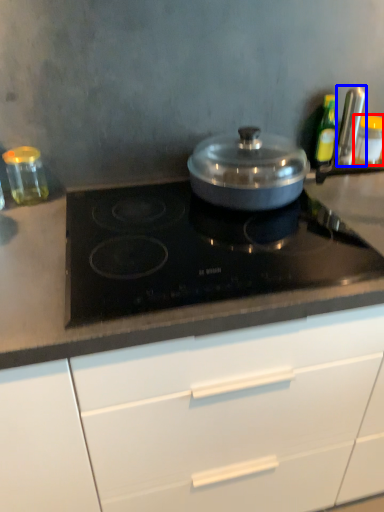
Question: Which of the following is the farthest to the observer, kitchen appliance (highlighted by a red box) or kitchen appliance (highlighted by a blue box)?

Choices:
 (A) kitchen appliance
 (B) kitchen appliance

Answer: (A)